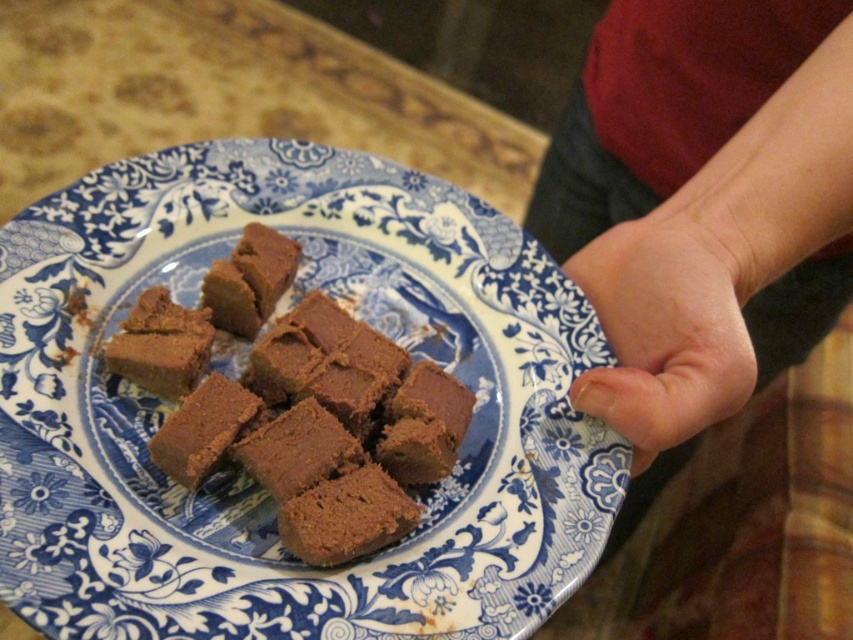
Between skinny white hand at center and smooth skin at center, which one appears on the left side from the viewer's perspective?

Positioned to the left is smooth skin at center.

Who is shorter, skinny white hand at center or smooth skin at center?

Standing shorter between the two is smooth skin at center.

Is point (711, 212) less distant than point (723, 204)?

No, (711, 212) is behind (723, 204).

Locate an element on the screen. skinny white hand at center is located at coordinates (701, 198).

Which is below, skinny white hand at center or brown matte fudge at center?

Positioned lower is brown matte fudge at center.

Does skinny white hand at center have a lesser width compared to brown matte fudge at center?

No, skinny white hand at center is not thinner than brown matte fudge at center.

Does point (645, 196) lie behind point (256, 260)?

That is True.

What are the coordinates of `skinny white hand at center` in the screenshot? It's located at (701, 198).

Can you confirm if blue glazed plate at center is thinner than smooth skin at center?

In fact, blue glazed plate at center might be wider than smooth skin at center.

In order to click on blue glazed plate at center in this screenshot , I will do 242,476.

Where is `blue glazed plate at center`? The height and width of the screenshot is (640, 853). blue glazed plate at center is located at coordinates (242, 476).